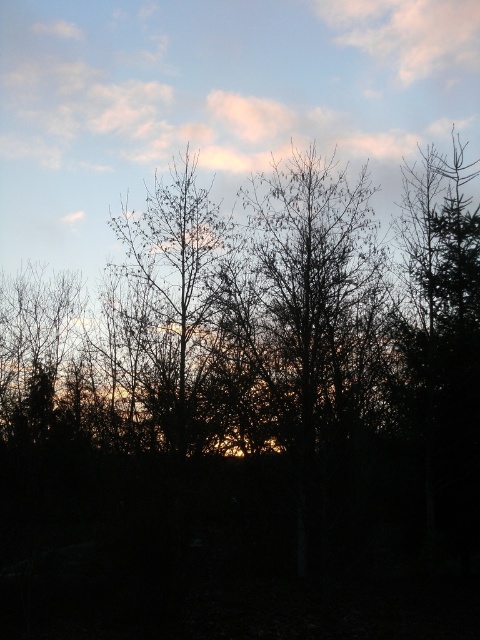
You are an artist sketching the scene and want to ensure the proportions are accurate. Which object in the image has a smaller width between the bare branches at center and the pink cotton cloud at upper center?

The bare branches at center has a lesser width compared to the pink cotton cloud at upper center, so the bare branches at center is the one with the smaller width.

You are standing in the center of the forest looking at the point marked at coordinates (178, 285). Based on the scene description, what can you see at that point?

At the coordinates (178, 285), you can see bare branches at center as described.